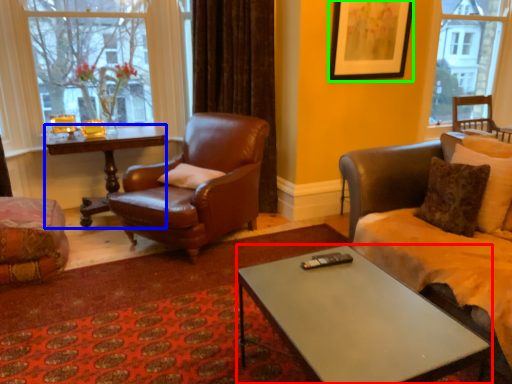
Question: Which object is the closest to the coffee table (highlighted by a red box)? Choose among these: desk (highlighted by a blue box) or picture frame (highlighted by a green box).

Choices:
 (A) desk
 (B) picture frame

Answer: (B)